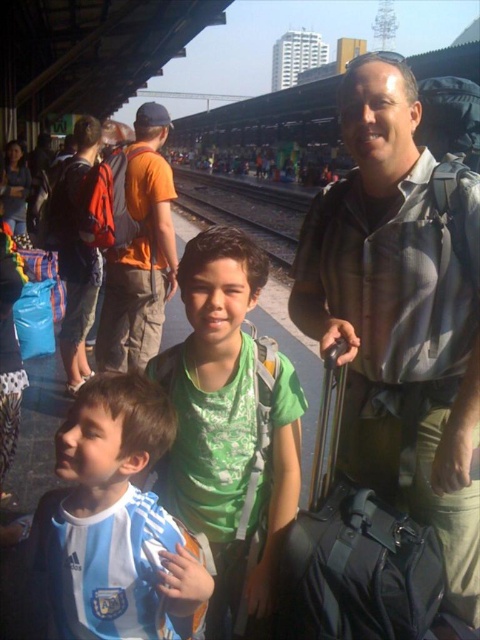
Question: Which of the following is the farthest from the observer?

Choices:
 (A) white jersey at lower left
 (B) matte black backpack at left
 (C) orange fabric backpack at center

Answer: (B)

Question: Observing the image, what is the correct spatial positioning of white jersey at lower left in reference to matte black backpack at left?

Choices:
 (A) above
 (B) below

Answer: (B)

Question: Among these objects, which one is farthest from the camera?

Choices:
 (A) white jersey at lower left
 (B) camouflage fabric backpack at center
 (C) metal train track at center

Answer: (C)

Question: Does green matte shirt at center have a larger size compared to white jersey at lower left?

Choices:
 (A) no
 (B) yes

Answer: (B)

Question: Which point appears farthest from the camera in this image?

Choices:
 (A) (194, 188)
 (B) (206, 458)
 (C) (82, 145)

Answer: (A)

Question: From the image, what is the correct spatial relationship of orange fabric backpack at center in relation to metal train track at center?

Choices:
 (A) below
 (B) above

Answer: (A)